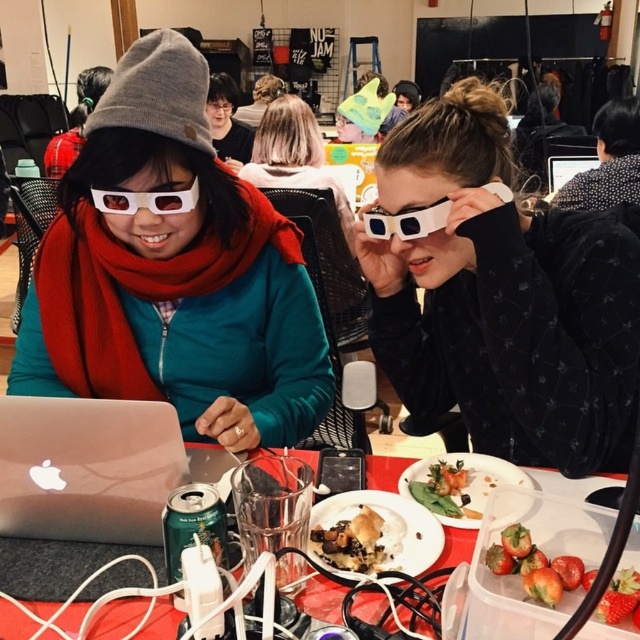
You are setting up a virtual reality station for an event. You have the blue plastic goggles at center and the silver metallic laptop at upper center. Where should you place the laptop relative to the goggles to match the image?

The silver metallic laptop at upper center should be placed above the blue plastic goggles at center to match the image.

You are standing at the back of the room and want to walk towards the point at the bottom right corner of the image. There are two points marked in the image, point at (157, 449) and point at (442, 461). Which point should you aim for to get closer to your destination?

Point at (442, 461) is further back than point at (157, 449), so you should aim for point at (442, 461) to get closer to the bottom right corner destination.

Consider the image. Please look at the image and locate the point at coordinates (563, 579). What object is this point located on?

The point at coordinates (563, 579) is located on the shiny red strawberries at lower right.